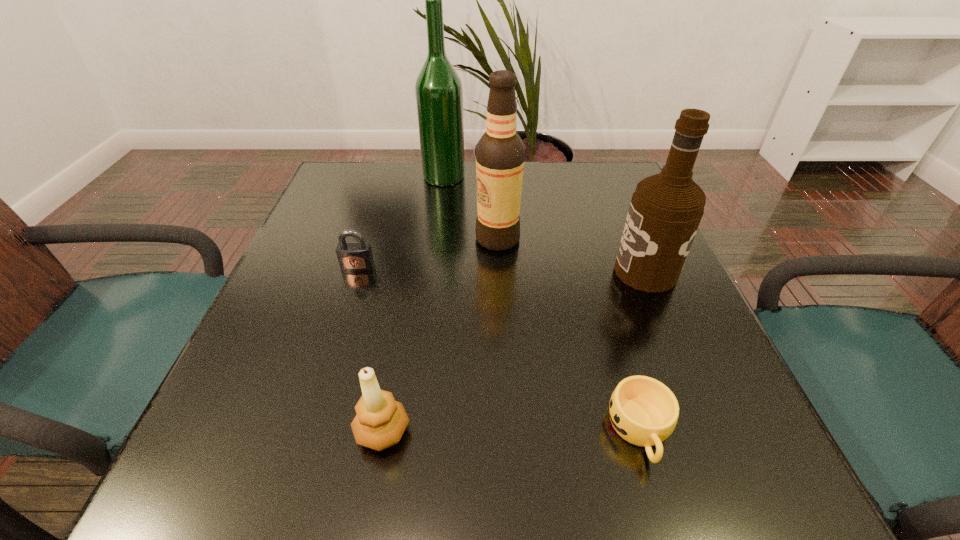
In order to click on vacant point at the near left corner in this screenshot , I will do `click(193, 450)`.

You are a GUI agent. You are given a task and a screenshot of the screen. Output one action in this format:
    pyautogui.click(x=<x>, y=<y>)
    Task: Click on the free spot between the rightmost alcohol and the padlock
    The height and width of the screenshot is (540, 960).
    Given the screenshot: What is the action you would take?
    pyautogui.click(x=501, y=269)

At what (x,y) coordinates should I click in order to perform the action: click on vacant area between the rightmost alcohol and the fourth tallest object. Please return your answer as a coordinate pair (x, y). Looking at the image, I should click on tap(514, 352).

Image resolution: width=960 pixels, height=540 pixels. In order to click on free space between the fourth tallest object and the rightmost alcohol in this screenshot , I will do `click(514, 352)`.

I want to click on unoccupied position between the shortest object and the farthest object, so click(x=542, y=303).

At what (x,y) coordinates should I click in order to perform the action: click on vacant space that's between the candle_holder and the second alcohol from left to right. Please return your answer as a coordinate pair (x, y). This screenshot has width=960, height=540. Looking at the image, I should click on (440, 335).

Locate an element on the screen. This screenshot has width=960, height=540. vacant space that's between the leftmost object and the cup is located at coordinates (499, 349).

In order to click on unoccupied area between the fifth tallest object and the shortest object in this screenshot , I will do `click(499, 349)`.

The image size is (960, 540). I want to click on vacant space in between the farthest alcohol and the fourth tallest object, so click(413, 304).

The image size is (960, 540). In order to click on free space that is in between the leftmost object and the leftmost alcohol in this screenshot , I will do `click(400, 221)`.